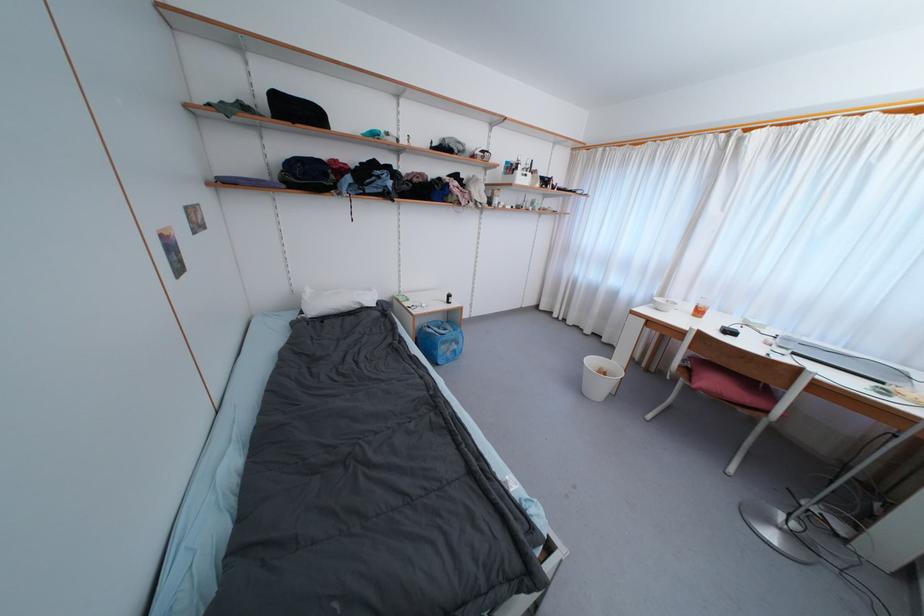
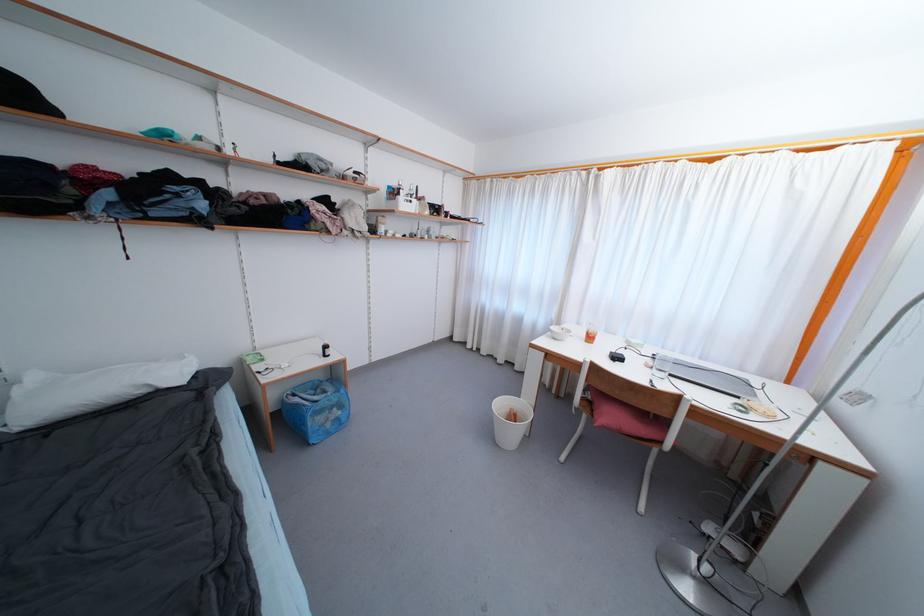
Find the pixel in the second image that matches (x=596, y=363) in the first image.

(505, 407)